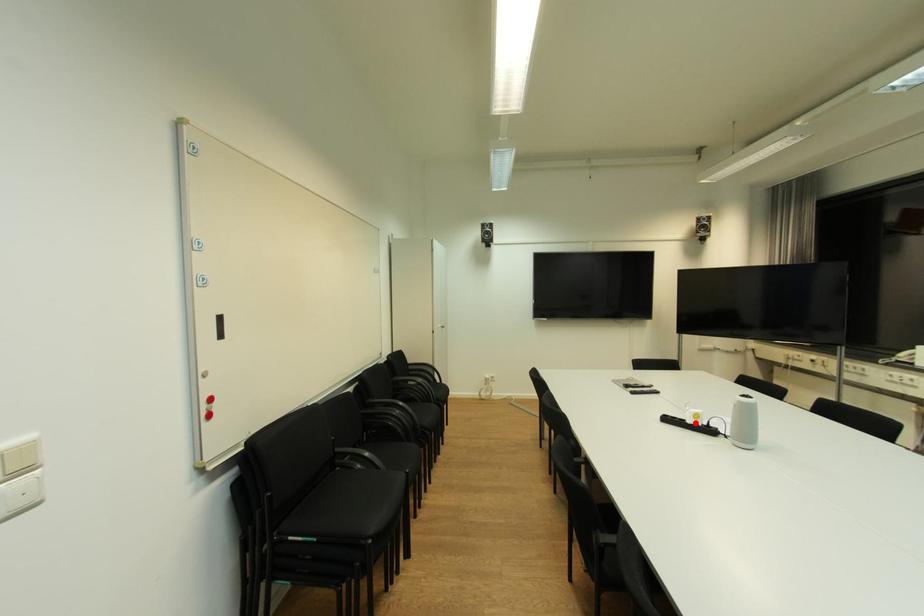
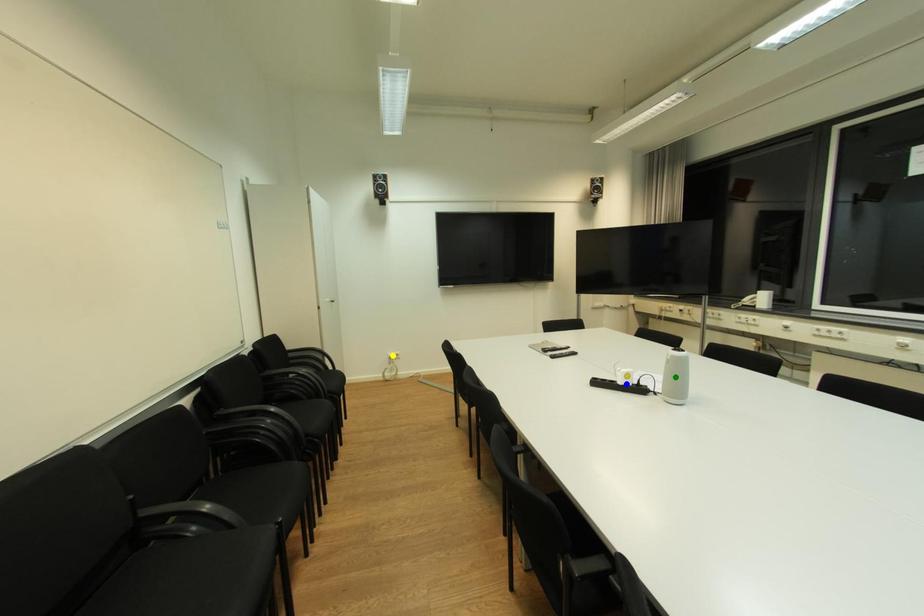
Question: I am providing you with two images of the same scene from different viewpoints. A red point is marked on the first image. You are given multiple points on the second image. In image 2, which mark is for the same physical point as the one in image 1?

Choices:
 (A) green point
 (B) blue point
 (C) yellow point

Answer: (B)